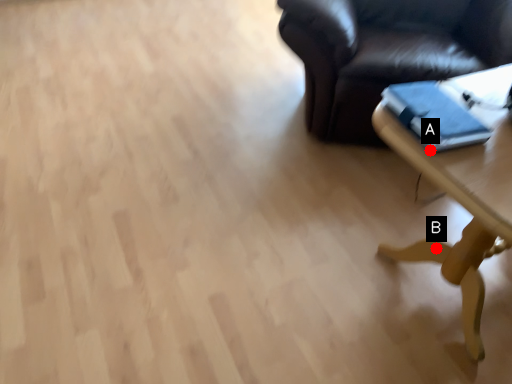
Question: Two points are circled on the image, labeled by A and B beside each circle. Which point is closer to the camera?

Choices:
 (A) A is closer
 (B) B is closer

Answer: (A)